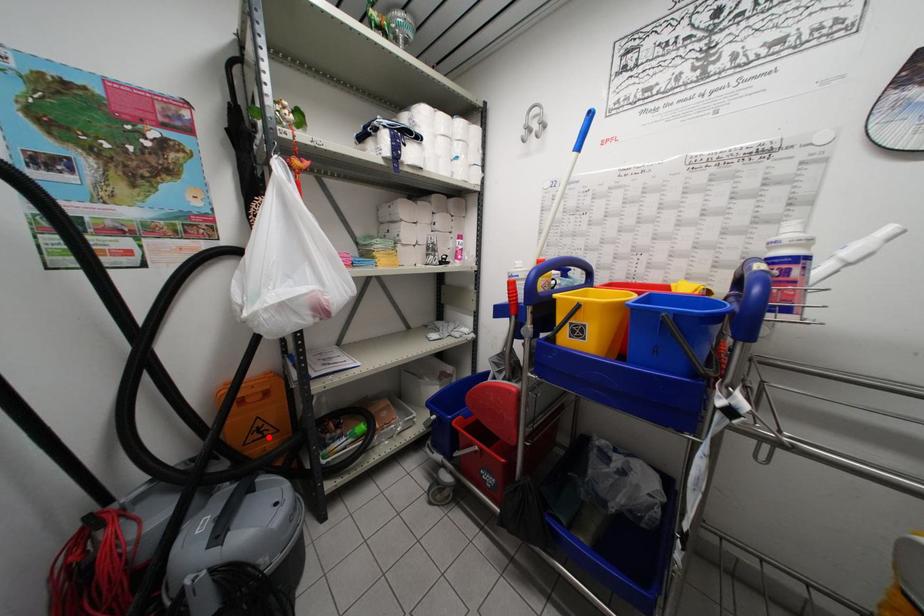
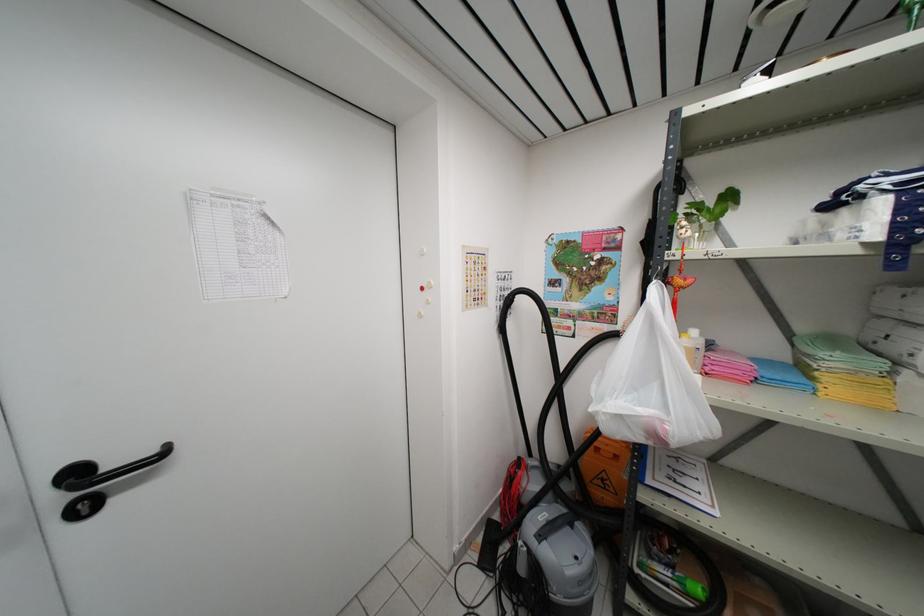
Where in the second image is the point corresponding to the highlighted location from the first image?

(610, 492)